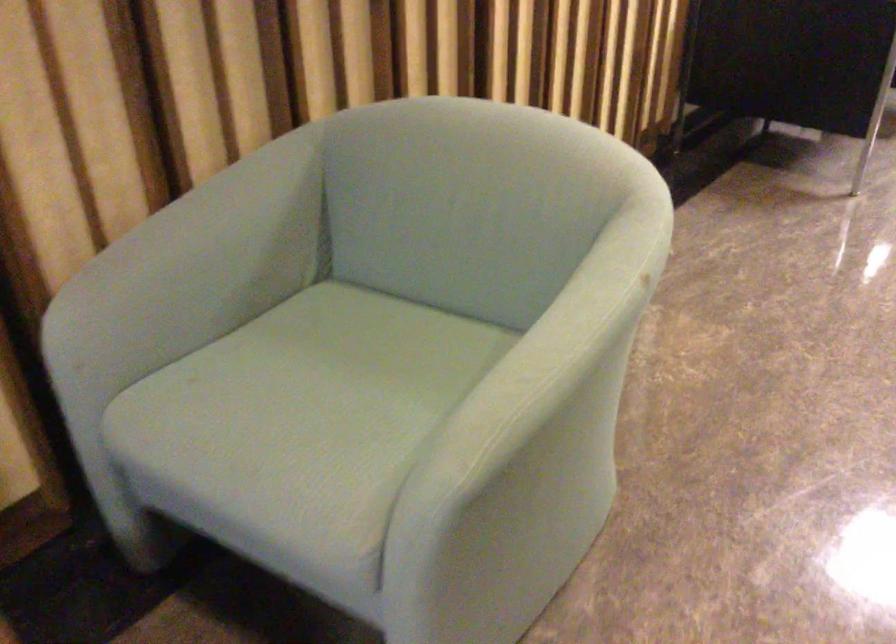
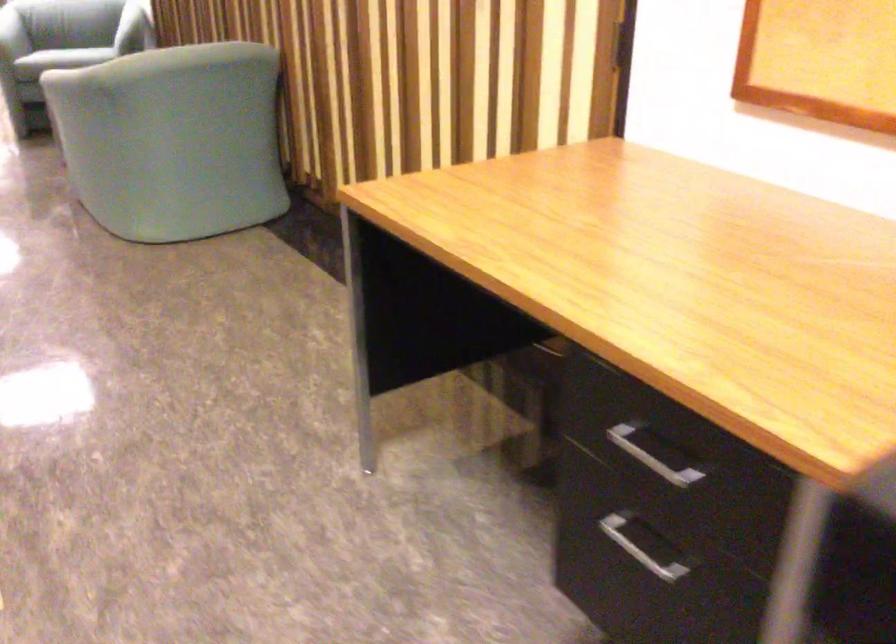
Question: I am providing you with two images of the same scene from different viewpoints. Which of the following objects are not visible in image2?

Choices:
 (A) metal drawer handle
 (B) chair armrest
 (C) white microwave dial
 (D) chair sitting surface

Answer: (D)